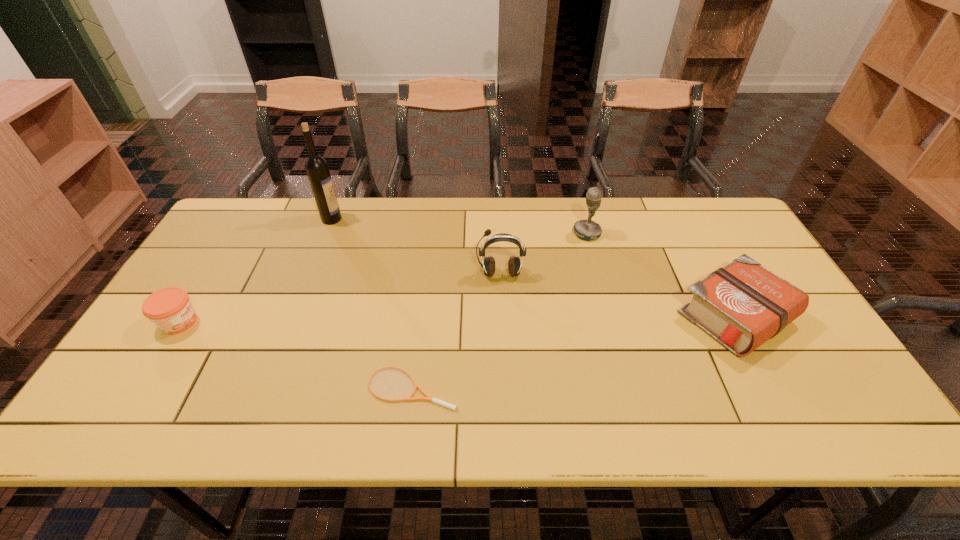
Image resolution: width=960 pixels, height=540 pixels. I want to click on free space that is in between the fourth object from left to right and the Bible, so coord(617,295).

The height and width of the screenshot is (540, 960). What are the coordinates of `free point between the tennis racket and the wine bottle` in the screenshot? It's located at (372, 303).

The width and height of the screenshot is (960, 540). I want to click on free area in between the microphone and the Bible, so click(661, 275).

Where is `vacant region between the fourth object from left to right and the rightmost object`? The width and height of the screenshot is (960, 540). vacant region between the fourth object from left to right and the rightmost object is located at coordinates (617, 295).

You are a GUI agent. You are given a task and a screenshot of the screen. Output one action in this format:
    pyautogui.click(x=<x>, y=<y>)
    Task: Click on the free spot between the third object from right to left and the tallest object
    The height and width of the screenshot is (540, 960).
    Given the screenshot: What is the action you would take?
    pyautogui.click(x=416, y=246)

Where is `free space between the rightmost object and the third object from left to right`? free space between the rightmost object and the third object from left to right is located at coordinates (573, 352).

Where is `free spot between the third object from right to left and the tennis racket`? Image resolution: width=960 pixels, height=540 pixels. free spot between the third object from right to left and the tennis racket is located at coordinates (456, 330).

Select which object is the third closest to the fifth object from left to right. Please provide its 2D coordinates. Your answer should be formatted as a tuple, i.e. [(x, y)], where the tuple contains the x and y coordinates of a point satisfying the conditions above.

[(428, 398)]

Point out which object is positioned as the third nearest to the wine bottle. Please provide its 2D coordinates. Your answer should be formatted as a tuple, i.e. [(x, y)], where the tuple contains the x and y coordinates of a point satisfying the conditions above.

[(428, 398)]

You are a GUI agent. You are given a task and a screenshot of the screen. Output one action in this format:
    pyautogui.click(x=<x>, y=<y>)
    Task: Click on the vacant region that satisfies the following two spatial constraints: 1. on the front-facing side of the rightmost object; 2. on the right side of the second object from right to left
    Image resolution: width=960 pixels, height=540 pixels.
    Given the screenshot: What is the action you would take?
    click(610, 317)